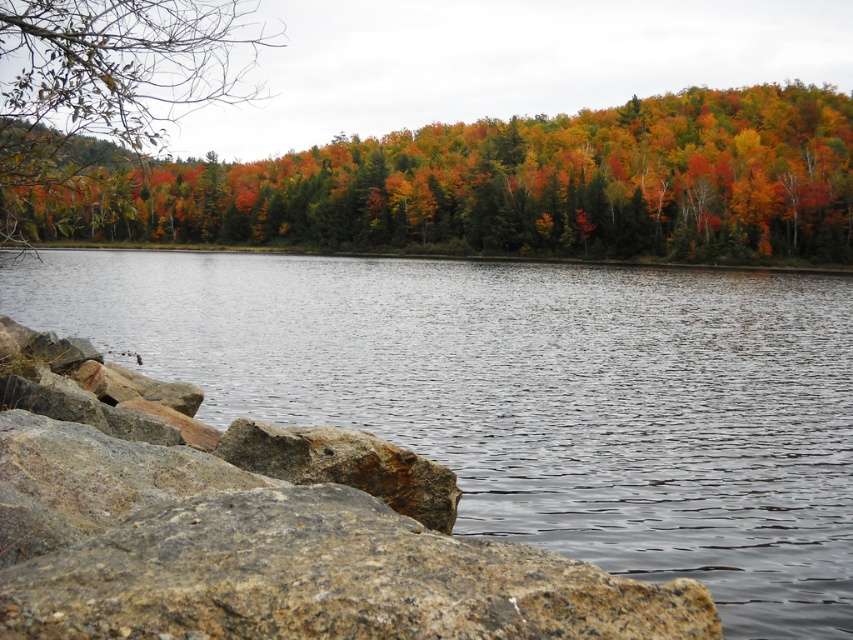
Based on the photo, you are standing at the lakeside and want to cross to the other side. The clear water at center is flowing gently. Considering the gray granite boulder at lower left, which object is higher in elevation?

The clear water at center is much taller as gray granite boulder at lower left, meaning the water is higher in elevation than the boulder.

You are standing at the lakeside and see two points marked in the image. Which point is closer to you, point (x=769, y=436) or point (x=235, y=538)?

Point (x=235, y=538) is closer to you because it is positioned closer to the viewer than point (x=769, y=436).

You are standing at the rocky shoreline and want to reach the clear water at center. Which direction should you move to get there?

The clear water at center is located at point (531, 396), so you should move towards the center of the lake from the rocky shoreline to reach it.